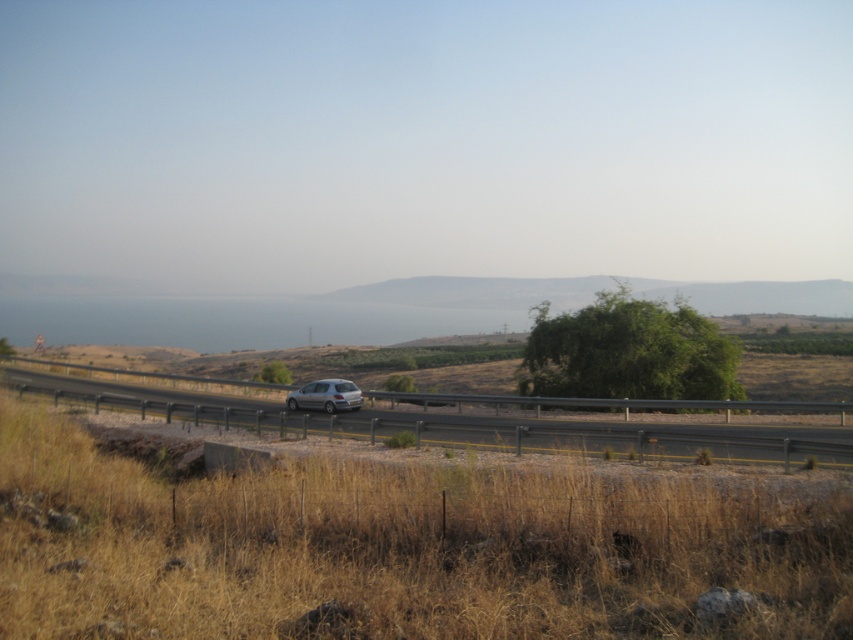
You are driving a car and see the dry grass at center and metallic gray highway at center ahead. Which object is closer to you?

The dry grass at center is closer to you because it is in front of the metallic gray highway at center.

You are a photographer planning to capture the entire scene of the dry grass at center and the satin silver hatchback at center in one shot. Given that your camera can only focus on objects within a 10m width, can both objects fit within the frame if they are positioned side by side?

The dry grass at center is larger in size than the satin silver hatchback at center. Since the camera can focus on objects within a 10m width, both objects can fit within the frame as their combined size is likely under 10 meters.